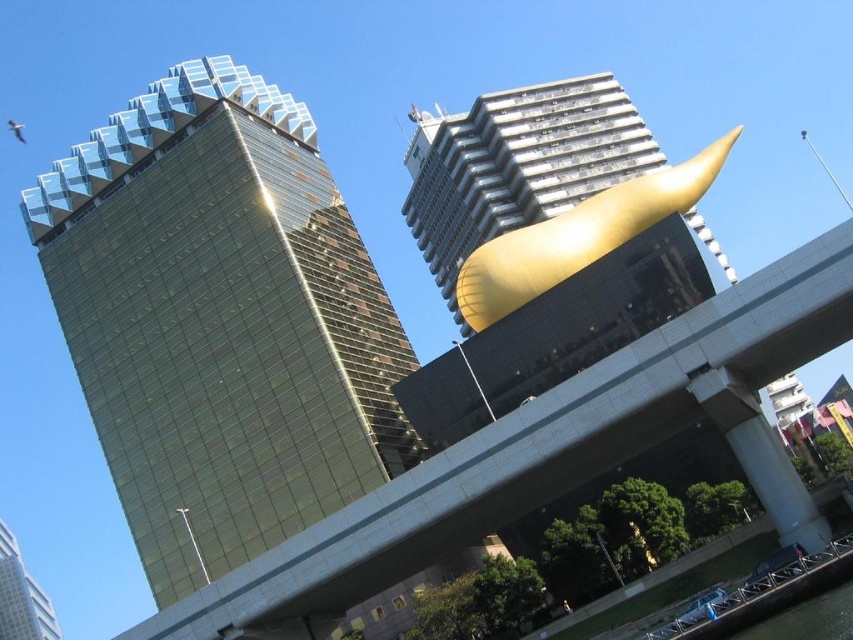
You are a city planner reviewing this urban layout. You need to determine if the gold metallic sculpture at upper right can be safely placed on a platform designed to support objects up to the height of the black rubber waterway at lower right. Based on their heights, what would you advise?

The gold metallic sculpture at upper right is much taller than the black rubber waterway at lower right, so it exceeds the platform height limit. Therefore, it cannot be safely placed there.